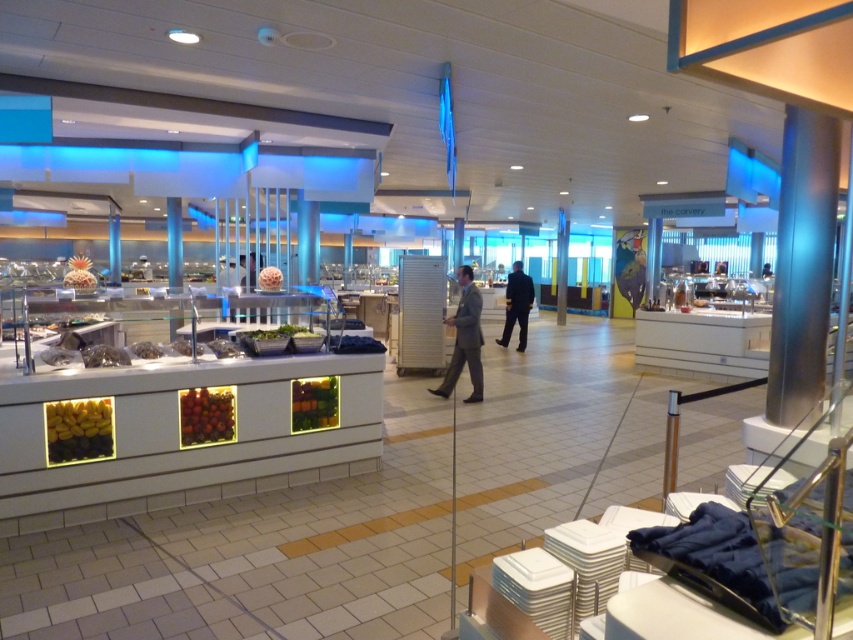
From the picture: Does gray suit at center have a lesser height compared to dark blue suit at center?

Correct, gray suit at center is not as tall as dark blue suit at center.

Which is behind, point (463, 342) or point (503, 326)?

Point (503, 326)

This screenshot has width=853, height=640. Find the location of `gray suit at center`. gray suit at center is located at coordinates [463, 339].

Is green matte apples at center taller than translucent plastic container at center?

Correct, green matte apples at center is much taller as translucent plastic container at center.

In the scene shown: Can you confirm if green matte apples at center is positioned below translucent plastic container at center?

Yes.

This screenshot has height=640, width=853. What do you see at coordinates (314, 403) in the screenshot?
I see `green matte apples at center` at bounding box center [314, 403].

What are the coordinates of `green matte apples at center` in the screenshot? It's located at (314, 403).

Can you confirm if shiny red apples at center is positioned to the left of translucent plastic container at center?

Indeed, shiny red apples at center is positioned on the left side of translucent plastic container at center.

Does shiny red apples at center have a lesser height compared to translucent plastic container at center?

Incorrect, shiny red apples at center's height does not fall short of translucent plastic container at center's.

Is point (223, 400) farther from viewer compared to point (265, 289)?

No, it is in front of (265, 289).

I want to click on shiny red apples at center, so click(206, 416).